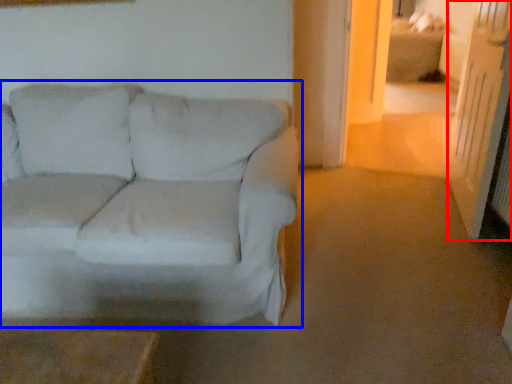
Question: Which point is closer to the camera, glass door (highlighted by a red box) or studio couch (highlighted by a blue box)?

Choices:
 (A) glass door
 (B) studio couch

Answer: (B)